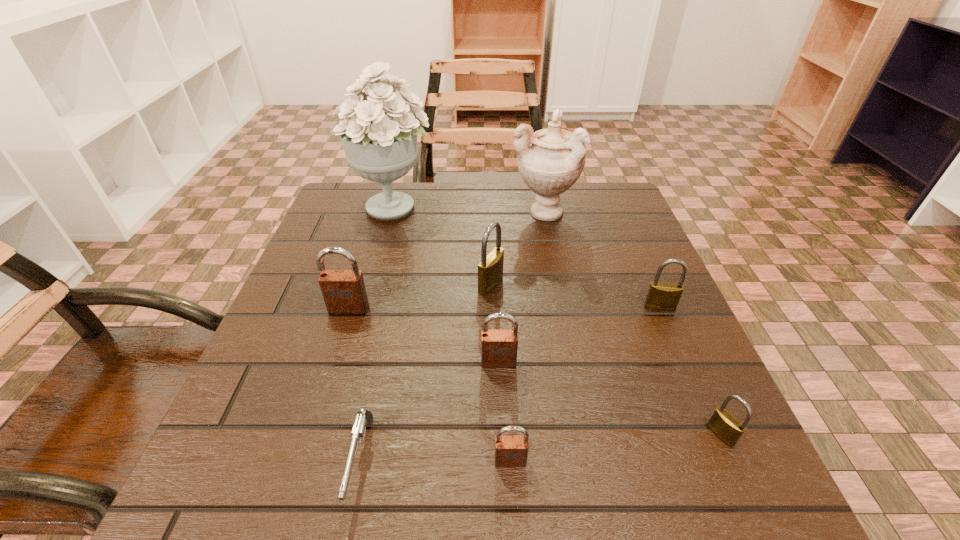
Find the location of a particular element. Image resolution: width=960 pixels, height=540 pixels. padlock at the left edge is located at coordinates click(x=344, y=292).

Locate an element on the screen. Image resolution: width=960 pixels, height=540 pixels. urn that is at the right edge is located at coordinates (550, 161).

The width and height of the screenshot is (960, 540). Find the location of `object positioned at the far left corner`. object positioned at the far left corner is located at coordinates (382, 147).

Find the location of a particular element. The height and width of the screenshot is (540, 960). object that is at the far right corner is located at coordinates (550, 161).

In the image, there is a desktop. Identify the location of blank space at the far edge. This screenshot has height=540, width=960. (460, 206).

The height and width of the screenshot is (540, 960). Identify the location of free space at the near edge of the desktop. (591, 470).

Where is `free location at the left edge`? This screenshot has width=960, height=540. free location at the left edge is located at coordinates (223, 453).

In the image, there is a desktop. Where is `vacant space at the right edge`? Image resolution: width=960 pixels, height=540 pixels. vacant space at the right edge is located at coordinates (612, 244).

In the image, there is a desktop. Where is `vacant space at the far left corner`? The width and height of the screenshot is (960, 540). vacant space at the far left corner is located at coordinates (379, 224).

Locate an element on the screen. vacant position at the far right corner of the desktop is located at coordinates (582, 195).